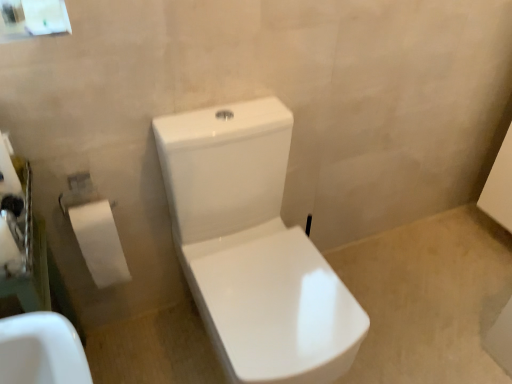
Question: Considering the positions of point (8, 230) and point (244, 124), is point (8, 230) closer or farther from the camera than point (244, 124)?

Choices:
 (A) farther
 (B) closer

Answer: (B)

Question: From the image's perspective, relative to white glossy toilet at center, is white paper at left above or below?

Choices:
 (A) above
 (B) below

Answer: (A)

Question: Estimate the real-world distances between objects in this image. Which object is closer to the white glossy toilet at center?

Choices:
 (A) white paper at left
 (B) white paper at left

Answer: (B)

Question: Estimate the real-world distances between objects in this image. Which object is farther from the white paper at left?

Choices:
 (A) white glossy toilet at center
 (B) white paper at left

Answer: (A)